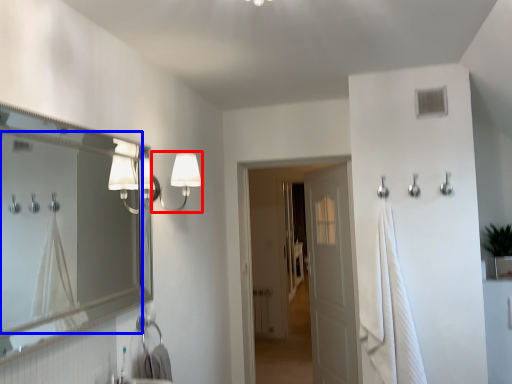
Question: Which of the following is the farthest to the observer, fixture (highlighted by a red box) or mirror (highlighted by a blue box)?

Choices:
 (A) fixture
 (B) mirror

Answer: (A)